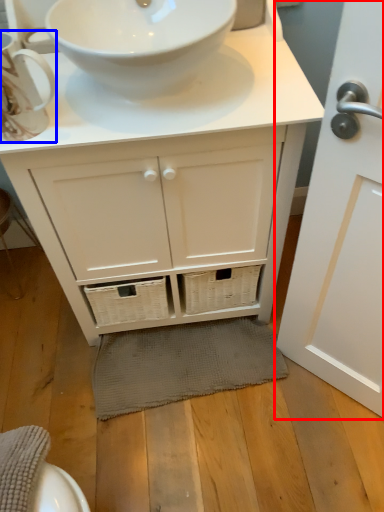
Question: Which object is further to the camera taking this photo, door (highlighted by a red box) or teacup (highlighted by a blue box)?

Choices:
 (A) door
 (B) teacup

Answer: (B)